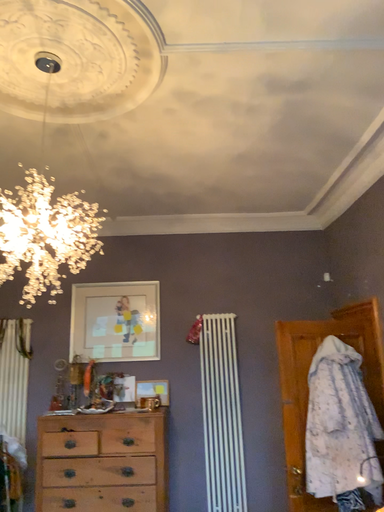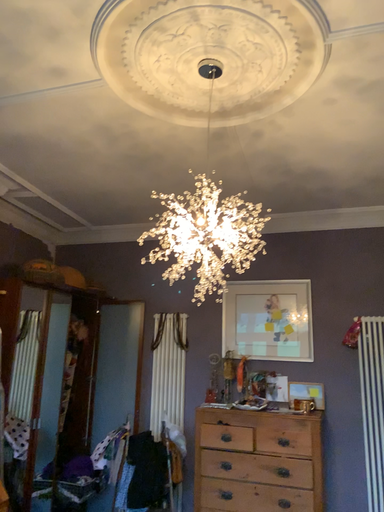
Question: How did the camera likely rotate when shooting the video?

Choices:
 (A) rotated left
 (B) rotated right

Answer: (A)